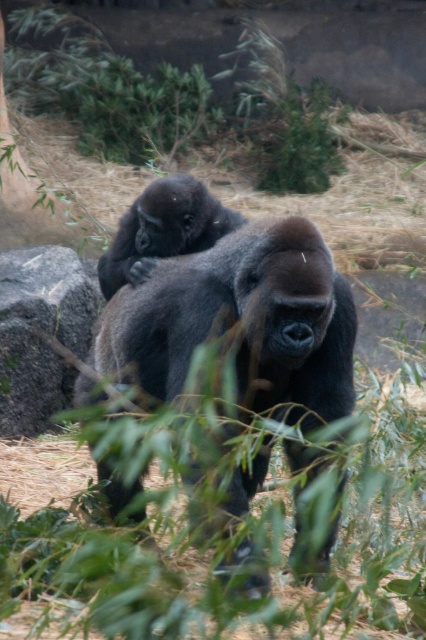
You are a zookeeper planning to place a new feeding tray in the enclosure. The tray must be placed between the green leafy grass at center and the dark brown fur at center. Considering their widths, which area should the tray be placed closer to for stability?

The green leafy grass at center has a larger width than the dark brown fur at center, so placing the feeding tray closer to the green leafy grass at center would provide better stability due to its wider base.

You are a zookeeper holding a camera and standing 2 meters away from the green leafy grass at center. Can you take a photo of the grass without moving your feet?

The distance between the green leafy grass at center and the camera is 1.99 meters, which is just under 2 meters. Since you are standing exactly 2 meters away, you need to move slightly closer to capture the grass within the camera range.